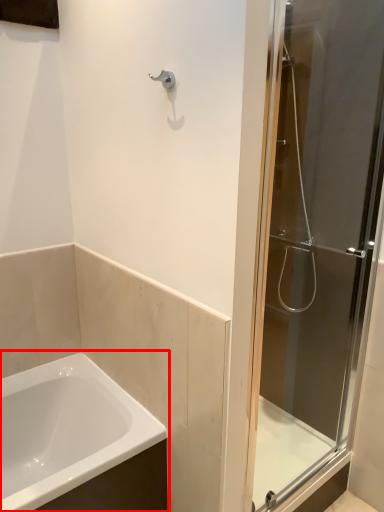
Question: From the image's perspective, where is bathtub (annotated by the red box) located relative to door?

Choices:
 (A) below
 (B) above

Answer: (A)